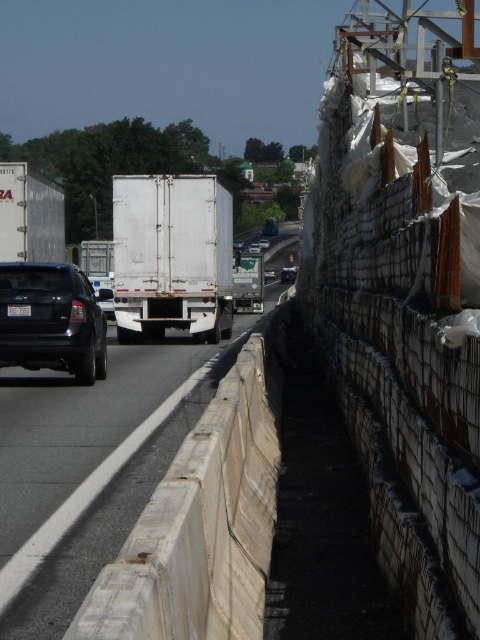
You are a photographer positioned at the center of the highway. You want to capture both the white matte truck at center and the shiny black sedan at center in a single frame. Which vehicle should you zoom out to include both?

Since the white matte truck at center is wider than the shiny black sedan at center, you should zoom out enough to accommodate the width of the white matte truck at center to include both vehicles in the frame.

You are a delivery driver who needs to pass under a low bridge that has a height restriction of 3 meters. You have two trucks available, the white matte trailer truck at center and the white glossy truck at center. Which truck should you choose to safely pass under the bridge?

The white glossy truck at center is shorter than the white matte trailer truck at center. Since the height restriction is 3 meters, the white glossy truck at center is the safer choice to pass under the bridge without hitting the height limit.